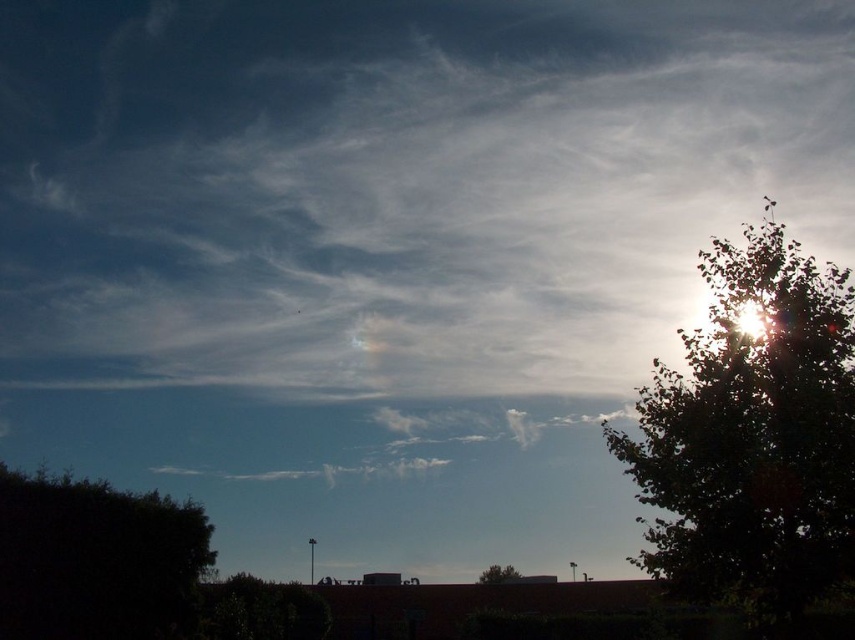
Can you confirm if green leafy tree at right is positioned to the left of green leafy tree at lower center?

No, green leafy tree at right is not to the left of green leafy tree at lower center.

Is green leafy tree at right smaller than green leafy tree at lower center?

Yes, green leafy tree at right is smaller than green leafy tree at lower center.

I want to click on green leafy tree at right, so click(753, 435).

Is green leafy tree at lower left smaller than green leafy tree at lower center?

Incorrect, green leafy tree at lower left is not smaller in size than green leafy tree at lower center.

Is point (109, 499) more distant than point (493, 572)?

No, it is in front of (493, 572).

Where is `green leafy tree at lower left`? green leafy tree at lower left is located at coordinates (95, 560).

Can you confirm if green leafy tree at right is smaller than green leafy tree at lower left?

Correct, green leafy tree at right occupies less space than green leafy tree at lower left.

Which is above, green leafy tree at right or green leafy tree at lower left?

Positioned higher is green leafy tree at right.

Between point (679, 488) and point (167, 531), which one is positioned in front?

Point (679, 488)

Locate an element on the screen. green leafy tree at right is located at coordinates (753, 435).